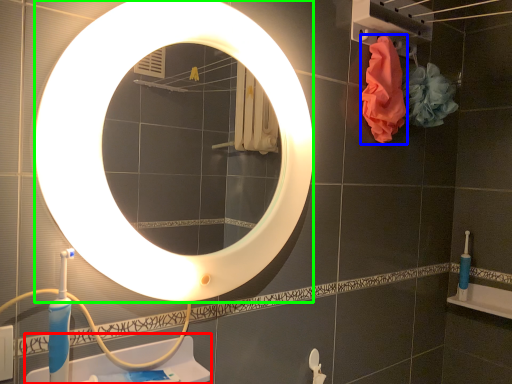
Question: Which object is the closest to the sink (highlighted by a red box)? Choose among these: material (highlighted by a blue box) or mirror (highlighted by a green box).

Choices:
 (A) material
 (B) mirror

Answer: (B)